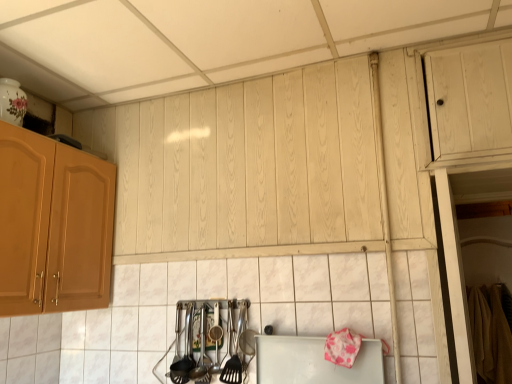
Question: Is white glossy tile at center bigger than white matte cutting board at lower center?

Choices:
 (A) yes
 (B) no

Answer: (A)

Question: Does white glossy tile at center contain white matte cutting board at lower center?

Choices:
 (A) no
 (B) yes

Answer: (A)

Question: From a real-world perspective, is white glossy tile at center on top of white matte cutting board at lower center?

Choices:
 (A) yes
 (B) no

Answer: (A)

Question: Is white glossy tile at center closer to camera compared to white matte cutting board at lower center?

Choices:
 (A) no
 (B) yes

Answer: (B)

Question: From the image's perspective, is white glossy tile at center on top of white matte cutting board at lower center?

Choices:
 (A) no
 (B) yes

Answer: (B)

Question: Relative to polished metal utensils at lower center, which is the first silverware from left to right, is polished stainless steel utensils at lower center, acting as the second silverware starting from the left, in front or behind?

Choices:
 (A) behind
 (B) front

Answer: (B)

Question: In terms of size, does polished stainless steel utensils at lower center, the first silverware viewed from the right, appear bigger or smaller than polished metal utensils at lower center, which is the first silverware from left to right?

Choices:
 (A) big
 (B) small

Answer: (A)

Question: Would you say polished stainless steel utensils at lower center, acting as the second silverware starting from the left, is to the left or to the right of polished metal utensils at lower center, the 2th silverware positioned from the right, in the picture?

Choices:
 (A) right
 (B) left

Answer: (A)

Question: Choose the correct answer: Is polished stainless steel utensils at lower center, acting as the second silverware starting from the left, inside polished metal utensils at lower center, which is the first silverware from left to right, or outside it?

Choices:
 (A) inside
 (B) outside

Answer: (B)

Question: Is point (166, 306) positioned closer to the camera than point (189, 357)?

Choices:
 (A) farther
 (B) closer

Answer: (A)

Question: In terms of height, does white glossy tile at center look taller or shorter compared to polished metal utensils at lower center, the 2th silverware positioned from the right?

Choices:
 (A) short
 (B) tall

Answer: (B)

Question: Considering their positions, is white glossy tile at center located in front of or behind polished metal utensils at lower center, the 2th silverware positioned from the right?

Choices:
 (A) behind
 (B) front

Answer: (B)

Question: Would you say white glossy tile at center is inside or outside polished metal utensils at lower center, which is the first silverware from left to right?

Choices:
 (A) outside
 (B) inside

Answer: (A)

Question: Would you say white matte cutting board at lower center is to the left or to the right of white glossy tile at center in the picture?

Choices:
 (A) left
 (B) right

Answer: (B)

Question: From a real-world perspective, is white matte cutting board at lower center positioned above or below white glossy tile at center?

Choices:
 (A) above
 (B) below

Answer: (B)